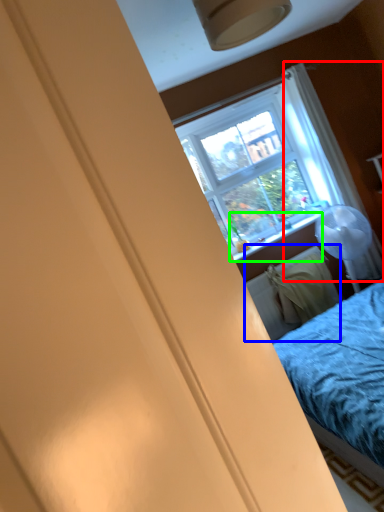
Question: Which is farther away from curtain (highlighted by a red box)? radiator (highlighted by a blue box) or window sill (highlighted by a green box)?

Choices:
 (A) radiator
 (B) window sill

Answer: (A)